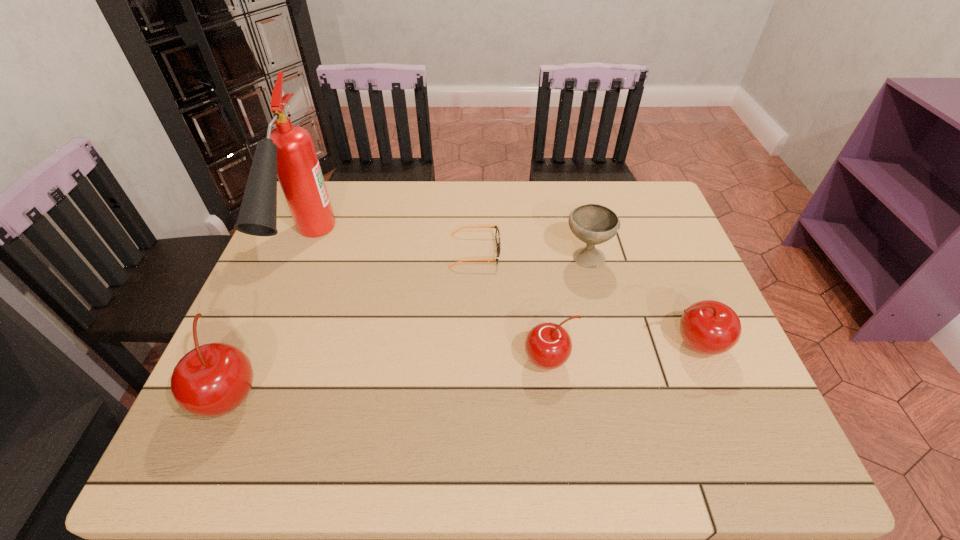
In order to click on object located in the near left corner section of the desktop in this screenshot , I will do `click(213, 379)`.

At what (x,y) coordinates should I click in order to perform the action: click on vacant point at the far edge. Please return your answer as a coordinate pair (x, y). Looking at the image, I should click on (369, 184).

Image resolution: width=960 pixels, height=540 pixels. I want to click on vacant region at the near edge of the desktop, so click(x=379, y=381).

Find the location of a particular element. Image resolution: width=960 pixels, height=540 pixels. free location at the left edge of the desktop is located at coordinates (273, 298).

The image size is (960, 540). In the image, there is a desktop. Identify the location of free region at the right edge. (667, 295).

What are the coordinates of `vacant space at the far right corner of the desktop` in the screenshot? It's located at (658, 194).

Image resolution: width=960 pixels, height=540 pixels. What are the coordinates of `vacant space at the near right corner` in the screenshot? It's located at (732, 404).

Locate an element on the screen. blank region between the rightmost object and the shortest cherry is located at coordinates (622, 353).

You are a GUI agent. You are given a task and a screenshot of the screen. Output one action in this format:
    pyautogui.click(x=<x>, y=<y>)
    Task: Click on the free space between the chalice and the fire extinguisher
    The width and height of the screenshot is (960, 540).
    Given the screenshot: What is the action you would take?
    pyautogui.click(x=446, y=254)

Find the location of a particular element. The image size is (960, 540). free area in between the fire extinguisher and the third object from right to left is located at coordinates (428, 305).